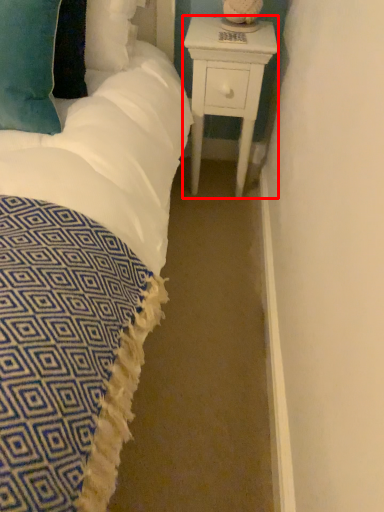
Question: Where is nightstand (annotated by the red box) located in relation to pillow in the image?

Choices:
 (A) left
 (B) right

Answer: (B)